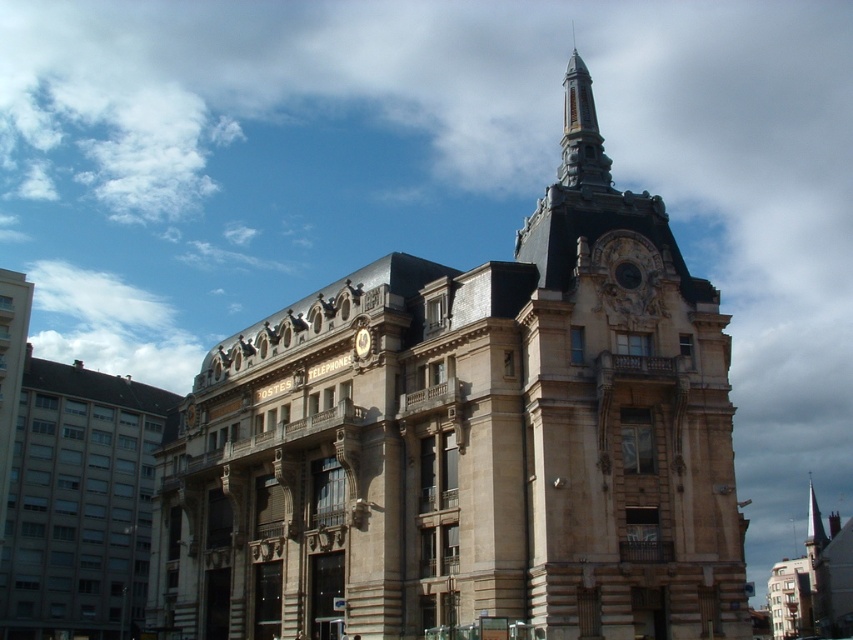
You are an architect evaluating the building for potential renovations. You need to install a new antenna on the tallest structure between the stone steeple at center and the polished stone spire at upper center. Which structure should you choose?

The polished stone spire at upper center is taller than the stone steeple at center, so the antenna should be installed on the polished stone spire at upper center.

You are a maintenance worker needing to inspect both the stone steeple at center and the polished stone spire at upper center. Given that your ladder can extend up to 20 meters, can you safely reach both structures without needing additional equipment?

The stone steeple at center is 22.78 meters from the polished stone spire at upper center. Since the ladder can only extend up to 20 meters, it is not long enough to reach the stone steeple at center from the polished stone spire at upper center. Additional equipment will be required.